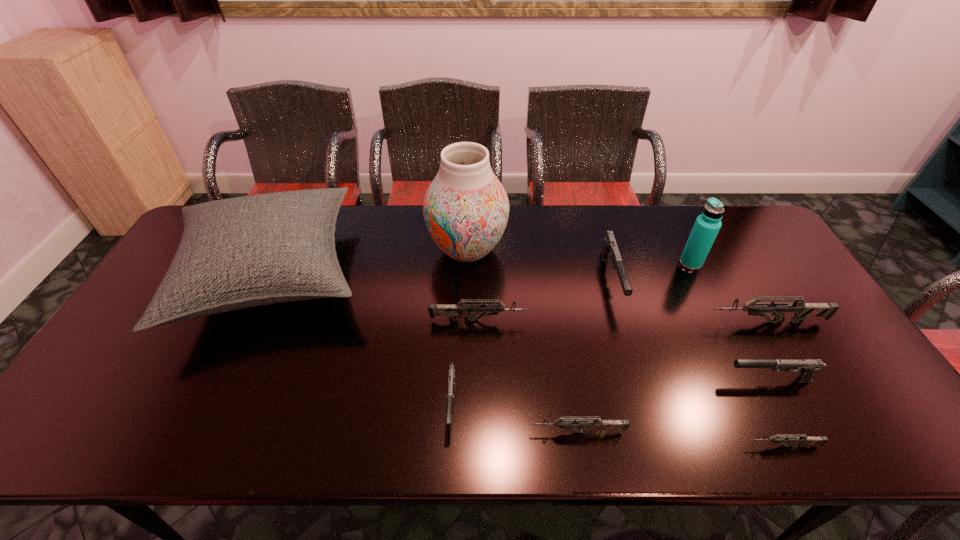
Locate an element on the screen. free space between the smallest gray gun and the rightmost gray gun is located at coordinates (611, 392).

Where is `vacant space in between the farthest gun and the leftmost object`? The height and width of the screenshot is (540, 960). vacant space in between the farthest gun and the leftmost object is located at coordinates (442, 277).

The width and height of the screenshot is (960, 540). I want to click on vacant region between the leftmost gray gun and the water bottle, so click(571, 333).

This screenshot has width=960, height=540. What are the coordinates of `free space that is in between the biggest grey gun and the second biggest grey gun` in the screenshot? It's located at (622, 321).

Image resolution: width=960 pixels, height=540 pixels. Identify the location of free space between the third smallest grey gun and the vase. (473, 285).

What are the coordinates of `free space between the nearest gun and the water bottle` in the screenshot? It's located at (736, 354).

Where is `unoccupied area between the biggest gray gun and the cushion`? unoccupied area between the biggest gray gun and the cushion is located at coordinates (442, 277).

Locate an element on the screen. The width and height of the screenshot is (960, 540). vacant space that is in between the farthest gray gun and the biggest grey gun is located at coordinates (689, 301).

Identify which object is located as the ninth nearest to the leftmost object. Please provide its 2D coordinates. Your answer should be formatted as a tuple, i.e. [(x, y)], where the tuple contains the x and y coordinates of a point satisfying the conditions above.

[(706, 227)]

You are a GUI agent. You are given a task and a screenshot of the screen. Output one action in this format:
    pyautogui.click(x=<x>, y=<y>)
    Task: Click on the object that is the ninth closest one to the cushion
    The image size is (960, 540).
    Given the screenshot: What is the action you would take?
    pyautogui.click(x=706, y=227)